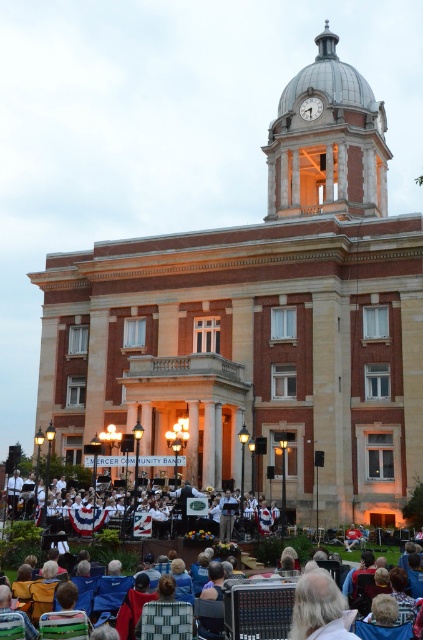
Question: Which is nearer to the metallic clock face at center?

Choices:
 (A) white uniformed band at center
 (B) metallic dome clock tower at upper center

Answer: (B)

Question: Can you confirm if metallic dome clock tower at upper center is smaller than metallic clock face at center?

Choices:
 (A) no
 (B) yes

Answer: (A)

Question: Which point is farther to the camera?

Choices:
 (A) metallic dome clock tower at upper center
 (B) white uniformed band at center
 (C) metallic clock face at center

Answer: (C)

Question: Is metallic dome clock tower at upper center bigger than white uniformed band at center?

Choices:
 (A) yes
 (B) no

Answer: (A)

Question: Can you confirm if metallic dome clock tower at upper center is smaller than white uniformed band at center?

Choices:
 (A) no
 (B) yes

Answer: (A)

Question: Among these points, which one is nearest to the camera?

Choices:
 (A) (126, 522)
 (B) (308, 202)

Answer: (A)